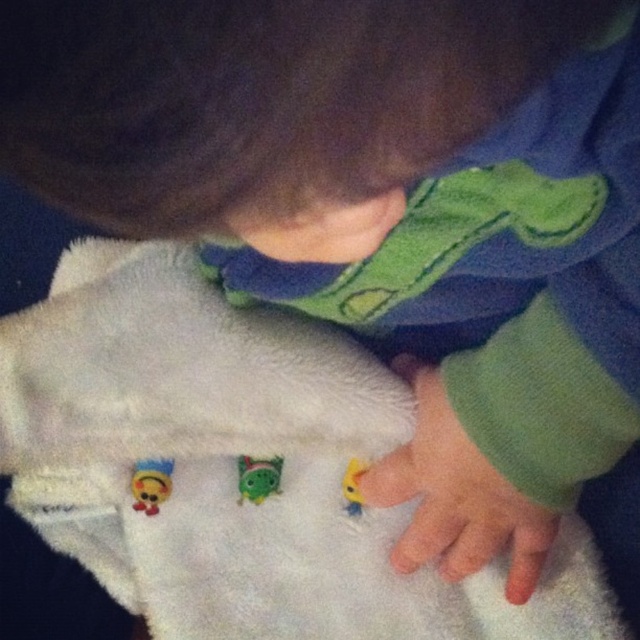
How far apart are smooth green hand at lower center and yellow matte toy at lower center?

They are 3.00 inches apart.

Which is in front, point (440, 392) or point (348, 508)?

Point (440, 392)

Is point (454, 460) more distant than point (353, 467)?

No, it is not.

Where is `smooth green hand at lower center`? smooth green hand at lower center is located at coordinates (456, 497).

Is green matte plush toy at center closer to camera compared to yellow matte toy at lower center?

No, green matte plush toy at center is behind yellow matte toy at lower center.

Does green matte plush toy at center have a lesser width compared to yellow matte toy at lower center?

Incorrect, green matte plush toy at center's width is not less than yellow matte toy at lower center's.

Locate an element on the screen. This screenshot has height=640, width=640. green matte plush toy at center is located at coordinates [x=257, y=477].

The image size is (640, 640). In order to click on green matte plush toy at center in this screenshot , I will do `click(257, 477)`.

Does white soft blanket at center appear over smooth green hand at lower center?

No, white soft blanket at center is not above smooth green hand at lower center.

Is white soft blanket at center behind smooth green hand at lower center?

Yes, white soft blanket at center is behind smooth green hand at lower center.

Is point (352, 566) positioned behind point (508, 529)?

That is True.

The image size is (640, 640). Find the location of `white soft blanket at center`. white soft blanket at center is located at coordinates (236, 467).